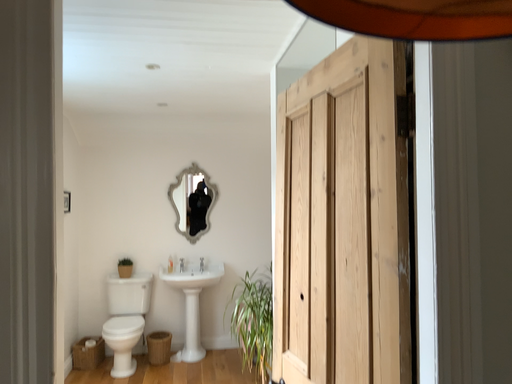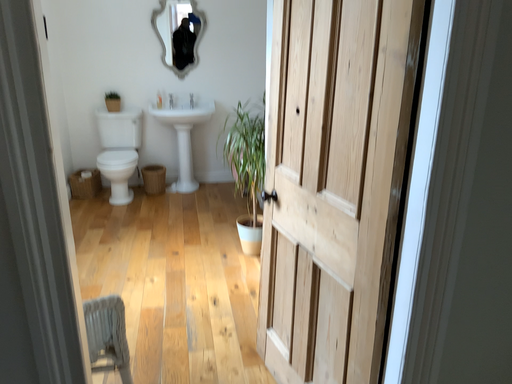
Question: How did the camera likely rotate when shooting the video?

Choices:
 (A) rotated downward
 (B) rotated upward

Answer: (A)